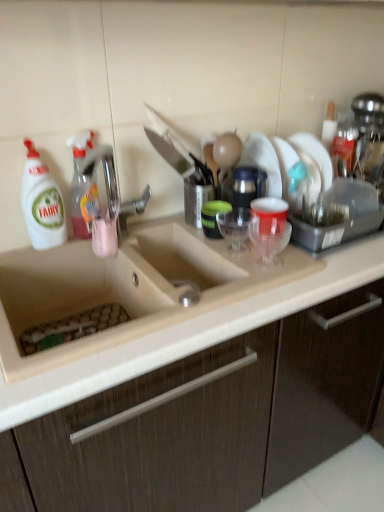
Question: Is translucent plastic cup at sink, positioned as the 2th tableware in right-to-left order, shorter than translucent plastic spray bottle at left, which appears as the 2th cleaning product when viewed from the left?

Choices:
 (A) no
 (B) yes

Answer: (B)

Question: From the image's perspective, is translucent plastic cup at sink, acting as the second tableware starting from the front, located above translucent plastic spray bottle at left, which appears as the 2th cleaning product when viewed from the left?

Choices:
 (A) no
 (B) yes

Answer: (A)

Question: Does translucent plastic cup at sink, acting as the second tableware starting from the front, have a greater height compared to translucent plastic spray bottle at left, positioned as the first cleaning product in right-to-left order?

Choices:
 (A) no
 (B) yes

Answer: (A)

Question: Can you confirm if translucent plastic cup at sink, acting as the second tableware starting from the front, is wider than translucent plastic spray bottle at left, which appears as the 2th cleaning product when viewed from the left?

Choices:
 (A) no
 (B) yes

Answer: (B)

Question: From a real-world perspective, is translucent plastic cup at sink, which is counted as the 1th tableware, starting from the back, positioned under translucent plastic spray bottle at left, which appears as the 2th cleaning product when viewed from the left, based on gravity?

Choices:
 (A) yes
 (B) no

Answer: (A)

Question: Is matte wood cabinet at center bigger or smaller than beige ceramic sink at center?

Choices:
 (A) big
 (B) small

Answer: (A)

Question: Considering the positions of matte wood cabinet at center and beige ceramic sink at center in the image, is matte wood cabinet at center wider or thinner than beige ceramic sink at center?

Choices:
 (A) thin
 (B) wide

Answer: (B)

Question: Is point (225, 362) closer or farther from the camera than point (41, 278)?

Choices:
 (A) farther
 (B) closer

Answer: (B)

Question: Relative to beige ceramic sink at center, is matte wood cabinet at center in front or behind?

Choices:
 (A) front
 (B) behind

Answer: (A)

Question: Do you think beige ceramic sink at center is within white plastic bottle at left, which is counted as the first cleaning product, starting from the left, or outside of it?

Choices:
 (A) outside
 (B) inside

Answer: (A)

Question: Is point (64, 350) positioned closer to the camera than point (64, 208)?

Choices:
 (A) closer
 (B) farther

Answer: (A)

Question: From the image's perspective, is beige ceramic sink at center positioned above or below white plastic bottle at left, marked as the 2th cleaning product in a right-to-left arrangement?

Choices:
 (A) above
 (B) below

Answer: (B)

Question: Considering the positions of beige ceramic sink at center and white plastic bottle at left, which is counted as the first cleaning product, starting from the left, in the image, is beige ceramic sink at center taller or shorter than white plastic bottle at left, which is counted as the first cleaning product, starting from the left,?

Choices:
 (A) short
 (B) tall

Answer: (A)

Question: Is point (77, 192) closer or farther from the camera than point (248, 286)?

Choices:
 (A) closer
 (B) farther

Answer: (B)

Question: From the image's perspective, is translucent plastic spray bottle at left, positioned as the first cleaning product in right-to-left order, positioned above or below beige ceramic sink at center?

Choices:
 (A) above
 (B) below

Answer: (A)